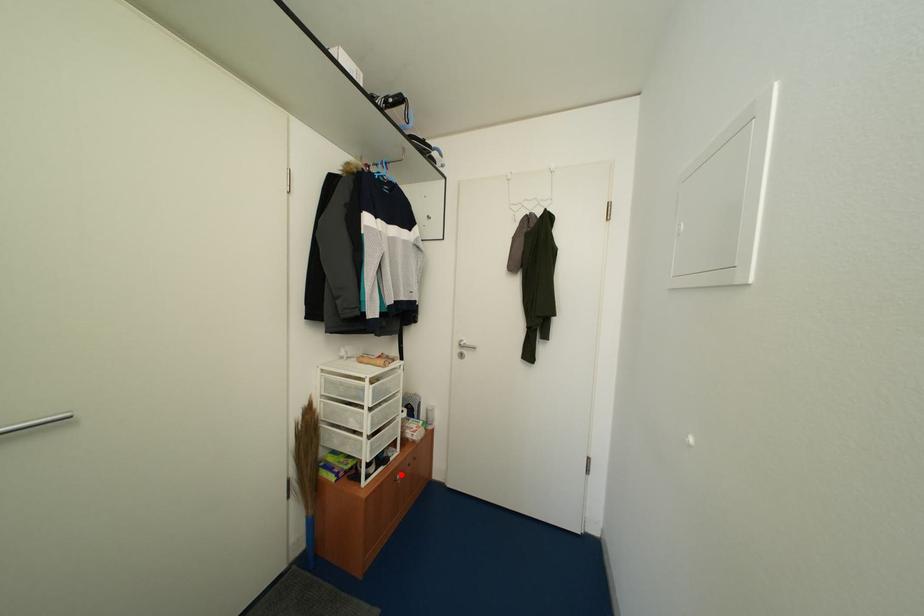
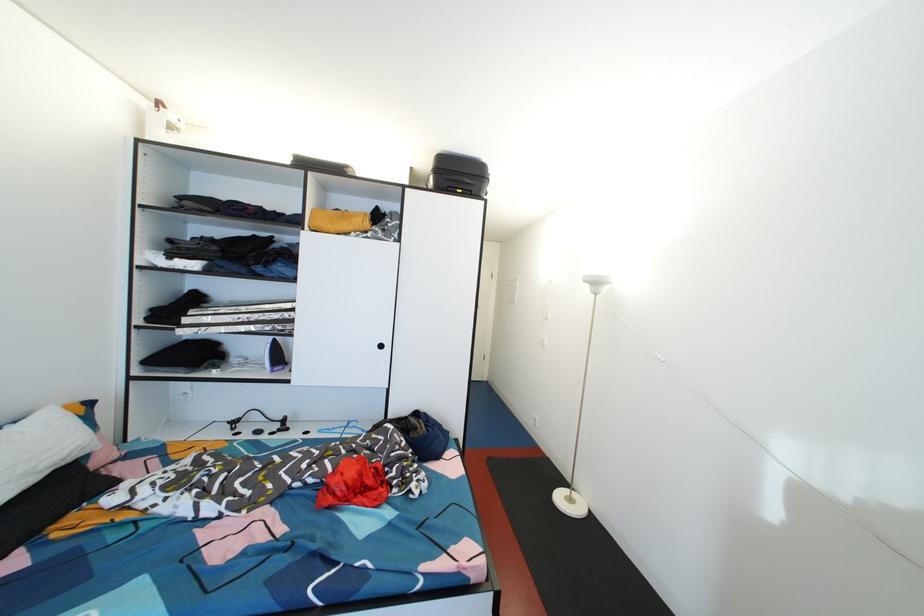
Question: I am providing you with two images of the same scene from different viewpoints. A red point is marked on the first image. Is the red point's position out of view in image 2?

Choices:
 (A) Yes
 (B) No

Answer: (A)